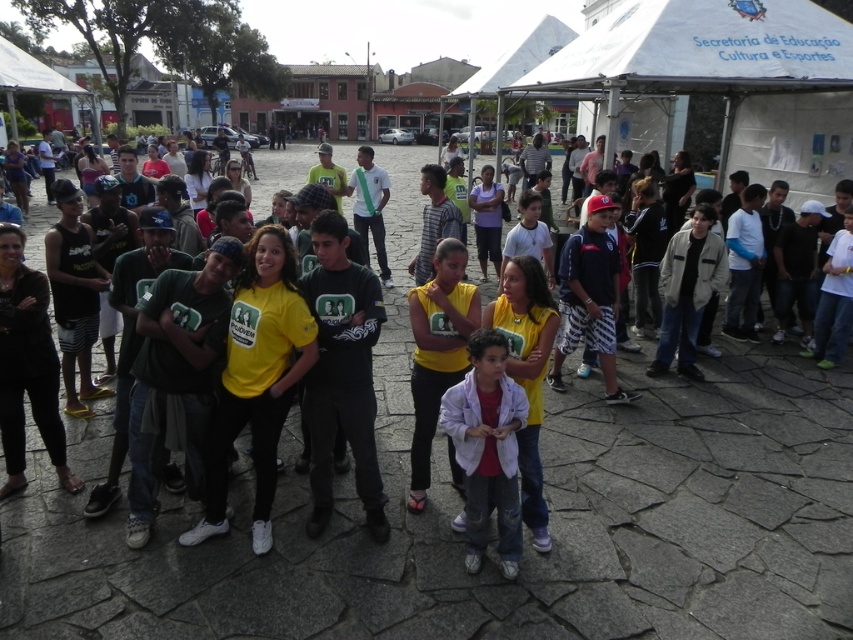
You are a photographer at the event and want to capture both the white matte jacket at center and the dark blue jersey at center in the same frame. Based on their positions, which one should you focus on first to ensure both are in the shot?

The white matte jacket at center is to the left of dark blue jersey at center, so focusing on the white matte jacket at center first will allow you to adjust the frame to include both items since they are positioned side by side.

You are standing at the origin point in the image. Which direction should you move to find the white matte jacket at center?

The white matte jacket at center is located at coordinates 0.700 in the x axis and 0.572 in the y axis, so you should move towards the right and slightly upwards from your current position to reach it.